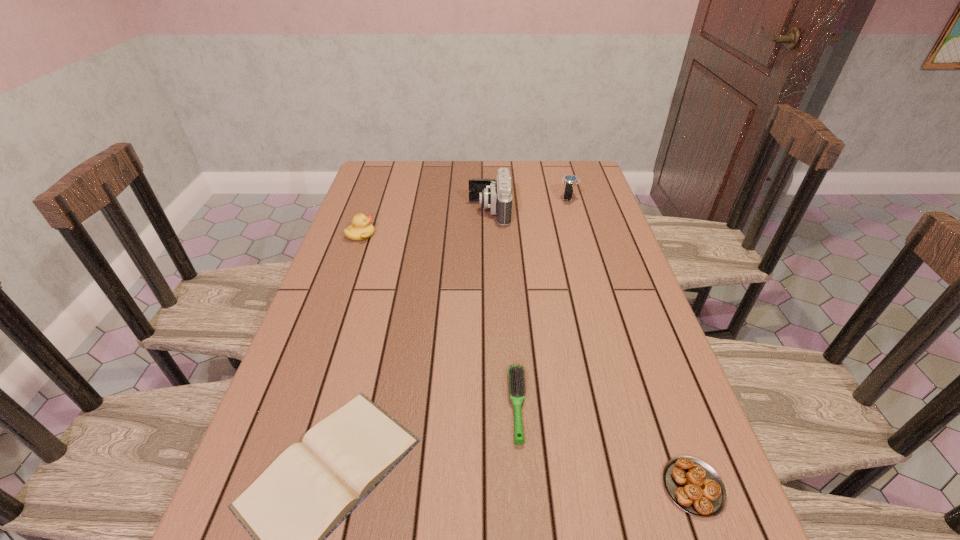
Locate an element on the screen. The width and height of the screenshot is (960, 540). free space located on the back of the hairbrush is located at coordinates (509, 280).

You are a GUI agent. You are given a task and a screenshot of the screen. Output one action in this format:
    pyautogui.click(x=<x>, y=<y>)
    Task: Click on the free space located 0.300m on the left of the pastry
    This screenshot has width=960, height=540.
    Given the screenshot: What is the action you would take?
    pyautogui.click(x=493, y=487)

Identify the location of object located in the far edge section of the desktop. (570, 181).

Image resolution: width=960 pixels, height=540 pixels. I want to click on object at the left edge, so click(x=361, y=229).

Where is `watch that is positioned at the right edge`? watch that is positioned at the right edge is located at coordinates (570, 181).

Locate an element on the screen. This screenshot has height=540, width=960. pastry located at the right edge is located at coordinates (693, 485).

This screenshot has height=540, width=960. Find the location of `object at the far right corner`. object at the far right corner is located at coordinates (570, 181).

In the image, there is a desktop. At what (x,y) coordinates should I click in order to perform the action: click on free space at the far edge. Please return your answer as a coordinate pair (x, y). Looking at the image, I should click on (537, 160).

You are a GUI agent. You are given a task and a screenshot of the screen. Output one action in this format:
    pyautogui.click(x=<x>, y=<y>)
    Task: Click on the free space at the left edge of the desktop
    
    Given the screenshot: What is the action you would take?
    pyautogui.click(x=359, y=377)

Locate an element on the screen. The width and height of the screenshot is (960, 540). blank area at the right edge is located at coordinates (594, 248).